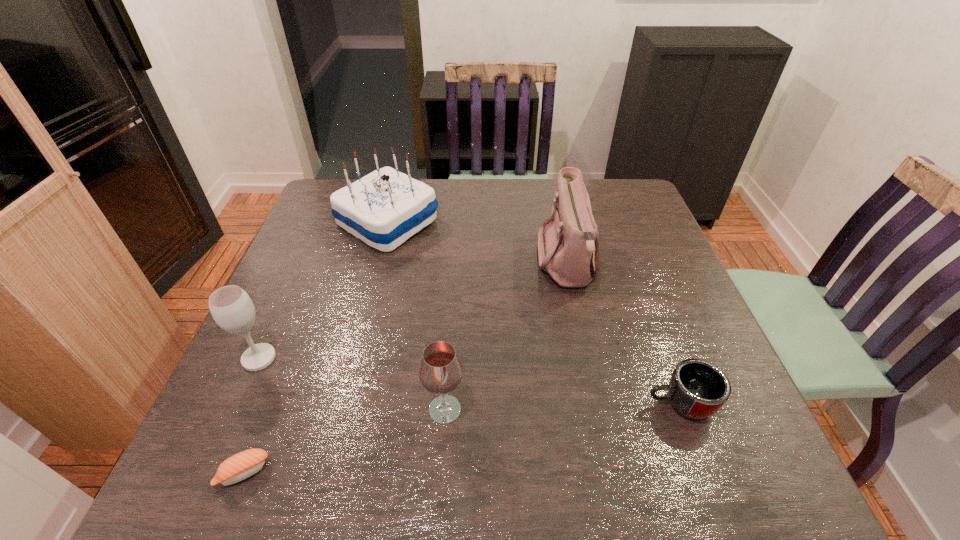
Where is `object located in the far edge section of the desktop`? This screenshot has width=960, height=540. object located in the far edge section of the desktop is located at coordinates (386, 207).

The image size is (960, 540). Identify the location of object that is at the near edge. (240, 466).

Identify the location of birthday cake located at the left edge. coord(386,207).

I want to click on wineglass at the left edge, so click(x=231, y=307).

Where is `sushi located in the left edge section of the desktop`? This screenshot has height=540, width=960. sushi located in the left edge section of the desktop is located at coordinates (240, 466).

You are a GUI agent. You are given a task and a screenshot of the screen. Output one action in this format:
    pyautogui.click(x=<x>, y=<y>)
    Task: Click on the object present at the right edge
    The height and width of the screenshot is (540, 960).
    Given the screenshot: What is the action you would take?
    pyautogui.click(x=698, y=389)

The image size is (960, 540). I want to click on object positioned at the far left corner, so click(x=386, y=207).

The height and width of the screenshot is (540, 960). In order to click on object located in the near left corner section of the desktop in this screenshot , I will do `click(240, 466)`.

This screenshot has height=540, width=960. Find the location of `free region at the far edge`. free region at the far edge is located at coordinates click(450, 219).

Where is `vacant space at the near edge of the desktop`? This screenshot has height=540, width=960. vacant space at the near edge of the desktop is located at coordinates (307, 492).